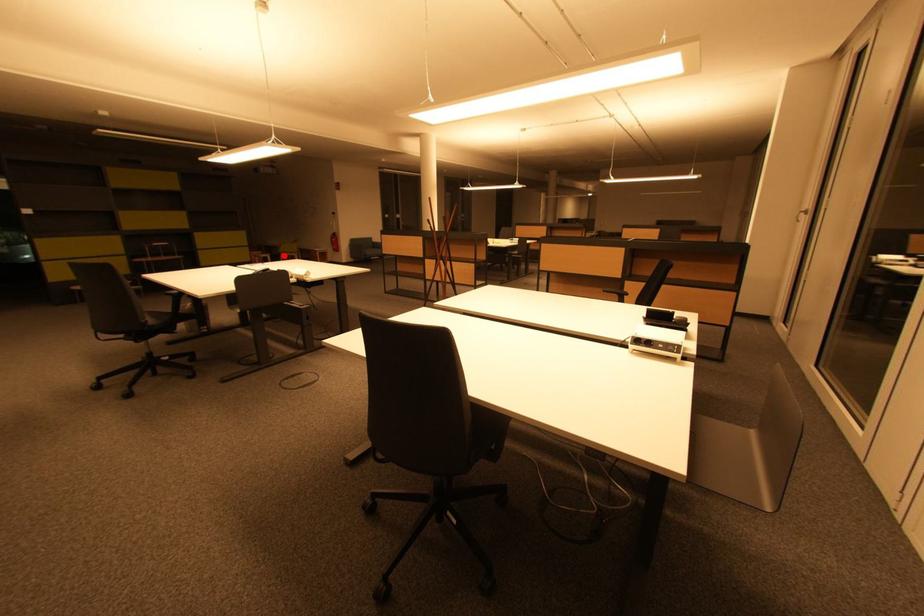
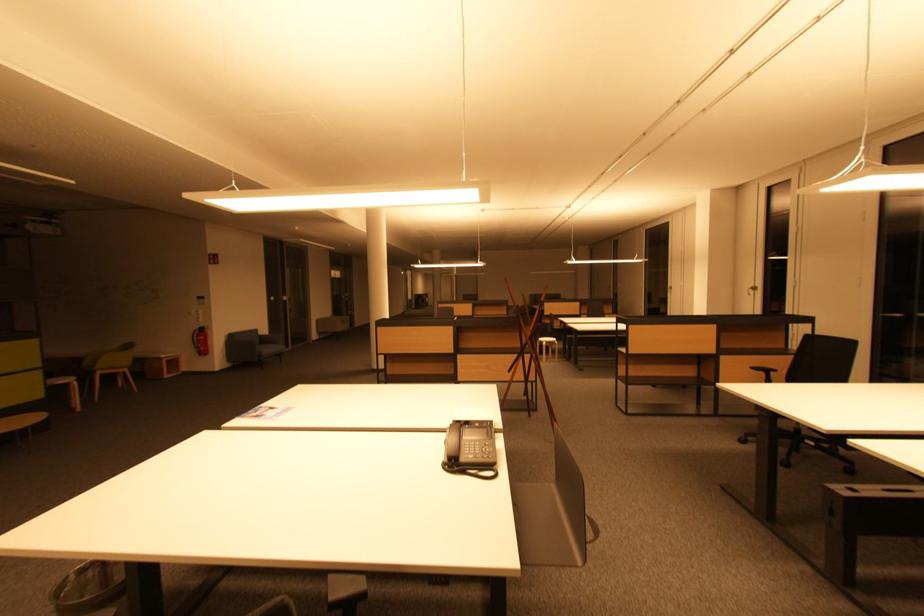
Question: I am providing you with two images of the same scene from different viewpoints. A red point is marked on the first image. Is the red point's position out of view in image 2?

Choices:
 (A) Yes
 (B) No

Answer: (B)